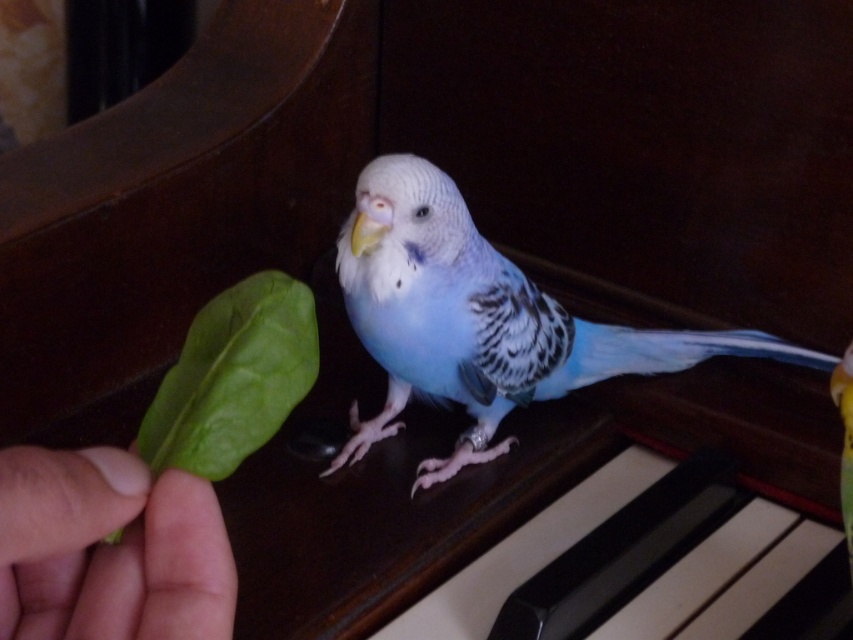
Question: Is green leafy at left thinner than green leafy at center?

Choices:
 (A) no
 (B) yes

Answer: (A)

Question: Can you confirm if light blue feathered parrot at center is thinner than green leafy at left?

Choices:
 (A) no
 (B) yes

Answer: (A)

Question: Which point is closer to the camera?

Choices:
 (A) (165, 467)
 (B) (843, 440)
 (C) (485, 452)

Answer: (A)

Question: Does green leafy at center have a larger size compared to blue glossy parrot at center?

Choices:
 (A) yes
 (B) no

Answer: (B)

Question: Which object is closer to the camera taking this photo?

Choices:
 (A) green leafy at left
 (B) blue glossy parrot at center
 (C) green leafy at center

Answer: (A)

Question: Estimate the real-world distances between objects in this image. Which object is farther from the green leafy at center?

Choices:
 (A) blue glossy parrot at center
 (B) light blue feathered parrot at center

Answer: (A)